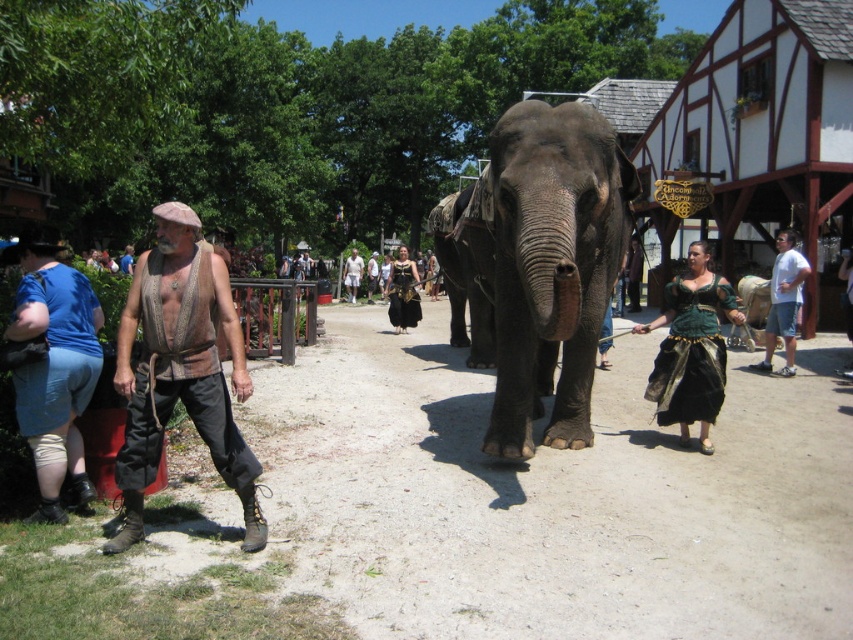
Question: Which point is farther to the camera?

Choices:
 (A) black velvet dress at center
 (B) green velvet dress at center

Answer: (A)

Question: Is brown woven vest at left above blue denim shorts at lower left?

Choices:
 (A) yes
 (B) no

Answer: (A)

Question: Which point appears farthest from the camera in this image?

Choices:
 (A) (135, 508)
 (B) (514, 202)

Answer: (B)

Question: Is green velvet dress at center below white cotton shirt at center?

Choices:
 (A) yes
 (B) no

Answer: (A)

Question: Which point is closer to the camera taking this photo?

Choices:
 (A) (387, 314)
 (B) (204, 380)
 (C) (596, 166)
 (D) (779, 230)

Answer: (B)

Question: From the image, what is the correct spatial relationship of blue denim shorts at lower left in relation to green velvet dress at center?

Choices:
 (A) above
 (B) below

Answer: (B)